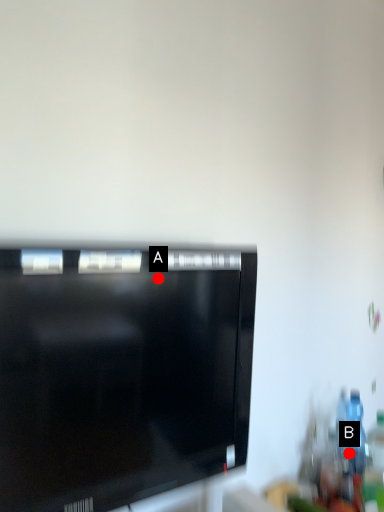
Question: Two points are circled on the image, labeled by A and B beside each circle. Which point is closer to the camera?

Choices:
 (A) A is closer
 (B) B is closer

Answer: (A)